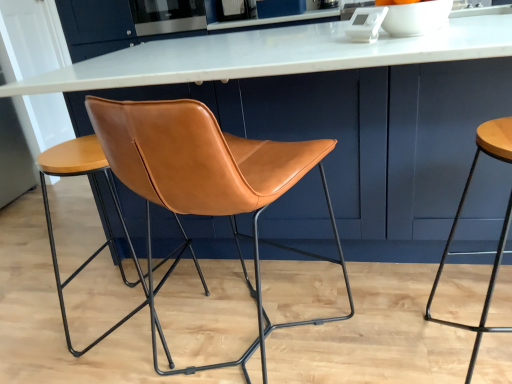
Find the location of a particular element. This screenshot has width=512, height=384. satin stainless steel oven at upper center is located at coordinates (167, 16).

This screenshot has width=512, height=384. Identify the location of matte brown stool at right, marked as the second stool in a left-to-right arrangement. (501, 231).

Looking at this image, measure the distance between leather at center, acting as the 2th stool starting from the right, and camera.

leather at center, acting as the 2th stool starting from the right, and camera are 1.21 meters apart from each other.

This screenshot has width=512, height=384. Describe the element at coordinates (206, 182) in the screenshot. I see `saddle brown leather chair at center` at that location.

Image resolution: width=512 pixels, height=384 pixels. In order to click on white marble table at center in this screenshot , I will do `click(271, 55)`.

Between saddle brown leather chair at center and satin stainless steel oven at upper center, which one is positioned in front?

saddle brown leather chair at center is closer to the camera.

From a real-world perspective, is saddle brown leather chair at center physically below satin stainless steel oven at upper center?

Indeed, from a real-world perspective, saddle brown leather chair at center is positioned beneath satin stainless steel oven at upper center.

From the image's perspective, which object appears higher, saddle brown leather chair at center or satin stainless steel oven at upper center?

satin stainless steel oven at upper center.

Considering the positions of objects saddle brown leather chair at center and satin stainless steel oven at upper center in the image provided, who is more to the right, saddle brown leather chair at center or satin stainless steel oven at upper center?

saddle brown leather chair at center is more to the right.

Is satin stainless steel oven at upper center in contact with leather at center, the 1th stool from the left?

No, satin stainless steel oven at upper center is not beside leather at center, the 1th stool from the left.

In terms of height, does satin stainless steel oven at upper center look taller or shorter compared to leather at center, acting as the 2th stool starting from the right?

Clearly, satin stainless steel oven at upper center is shorter compared to leather at center, acting as the 2th stool starting from the right.

Does satin stainless steel oven at upper center turn towards leather at center, the 1th stool from the left?

Yes, satin stainless steel oven at upper center is facing leather at center, the 1th stool from the left.

From a real-world perspective, which object rests below the other?

From a 3D spatial view, saddle brown leather chair at center is below.

Locate an element on the screen. This screenshot has height=384, width=512. chair beneath the satin stainless steel oven at upper center (from a real-world perspective) is located at coordinates (206, 182).

Is satin stainless steel oven at upper center far from saddle brown leather chair at center?

Yes.

Between leather at center, the 1th stool from the left, and saddle brown leather chair at center, which one has larger size?

saddle brown leather chair at center is bigger.

Between leather at center, the 1th stool from the left, and saddle brown leather chair at center, which one has smaller width?

With smaller width is leather at center, the 1th stool from the left.

Who is taller, leather at center, acting as the 2th stool starting from the right, or saddle brown leather chair at center?

saddle brown leather chair at center.

Considering the positions of point (84, 352) and point (208, 166), is point (84, 352) closer or farther from the camera than point (208, 166)?

Point (84, 352) is farther from the camera than point (208, 166).

Would you say leather at center, acting as the 2th stool starting from the right, is to the left or to the right of matte brown stool at right, marked as the second stool in a left-to-right arrangement, in the picture?

leather at center, acting as the 2th stool starting from the right, is to the left of matte brown stool at right, marked as the second stool in a left-to-right arrangement.

Consider the image. Measure the distance from leather at center, acting as the 2th stool starting from the right, to matte brown stool at right, marked as the second stool in a left-to-right arrangement.

leather at center, acting as the 2th stool starting from the right, is 1.22 meters away from matte brown stool at right, marked as the second stool in a left-to-right arrangement.

Where is `stool below the matte brown stool at right, marked as the second stool in a left-to-right arrangement (from a real-world perspective)`? The image size is (512, 384). stool below the matte brown stool at right, marked as the second stool in a left-to-right arrangement (from a real-world perspective) is located at coordinates (99, 208).

Is white marble table at center outside of leather at center, acting as the 2th stool starting from the right?

Indeed, white marble table at center is completely outside leather at center, acting as the 2th stool starting from the right.

Are white marble table at center and leather at center, the 1th stool from the left, far apart?

No, white marble table at center is not far from leather at center, the 1th stool from the left.

Which of these two, white marble table at center or leather at center, acting as the 2th stool starting from the right, stands taller?

Standing taller between the two is white marble table at center.

Considering the positions of objects white marble table at center and leather at center, acting as the 2th stool starting from the right, in the image provided, who is more to the left, white marble table at center or leather at center, acting as the 2th stool starting from the right,?

leather at center, acting as the 2th stool starting from the right.

Is saddle brown leather chair at center inside or outside of leather at center, the 1th stool from the left?

saddle brown leather chair at center is not enclosed by leather at center, the 1th stool from the left.

From a real-world perspective, between saddle brown leather chair at center and leather at center, acting as the 2th stool starting from the right, who is vertically higher?

saddle brown leather chair at center, from a real-world perspective.

Could you measure the distance between saddle brown leather chair at center and leather at center, acting as the 2th stool starting from the right?

saddle brown leather chair at center is 55.83 centimeters from leather at center, acting as the 2th stool starting from the right.

You are a GUI agent. You are given a task and a screenshot of the screen. Output one action in this format:
    pyautogui.click(x=<x>, y=<y>)
    Task: Click on the appliance that is above the saddle brown leather chair at center (from the image's perspective)
    
    Given the screenshot: What is the action you would take?
    coord(167,16)

You are a GUI agent. You are given a task and a screenshot of the screen. Output one action in this format:
    pyautogui.click(x=<x>, y=<y>)
    Task: Click on the 2nd stool positioned below the satin stainless steel oven at upper center (from the image's perspective)
    The height and width of the screenshot is (384, 512).
    Given the screenshot: What is the action you would take?
    click(x=99, y=208)

Based on their spatial positions, is saddle brown leather chair at center or matte brown stool at right, which is the 1th stool from right to left, further from leather at center, acting as the 2th stool starting from the right?

Based on the image, matte brown stool at right, which is the 1th stool from right to left, appears to be further to leather at center, acting as the 2th stool starting from the right.

Estimate the real-world distances between objects in this image. Which object is closer to matte brown stool at right, marked as the second stool in a left-to-right arrangement, leather at center, acting as the 2th stool starting from the right, or saddle brown leather chair at center?

Based on the image, saddle brown leather chair at center appears to be nearer to matte brown stool at right, marked as the second stool in a left-to-right arrangement.

Based on their spatial positions, is white marble table at center or satin stainless steel oven at upper center further from leather at center, acting as the 2th stool starting from the right?

satin stainless steel oven at upper center is further to leather at center, acting as the 2th stool starting from the right.

Estimate the real-world distances between objects in this image. Which object is further from leather at center, acting as the 2th stool starting from the right, saddle brown leather chair at center or white marble table at center?

white marble table at center lies further to leather at center, acting as the 2th stool starting from the right, than the other object.

Looking at the image, which one is located closer to white marble table at center, leather at center, acting as the 2th stool starting from the right, or saddle brown leather chair at center?

The object closer to white marble table at center is saddle brown leather chair at center.

When comparing their distances from matte brown stool at right, marked as the second stool in a left-to-right arrangement, does white marble table at center or leather at center, acting as the 2th stool starting from the right, seem further?

leather at center, acting as the 2th stool starting from the right, is positioned further to the anchor matte brown stool at right, marked as the second stool in a left-to-right arrangement.

Looking at the image, which one is located further to saddle brown leather chair at center, matte brown stool at right, marked as the second stool in a left-to-right arrangement, or leather at center, acting as the 2th stool starting from the right?

matte brown stool at right, marked as the second stool in a left-to-right arrangement, is further to saddle brown leather chair at center.

Considering their positions, is white marble table at center positioned closer to saddle brown leather chair at center than satin stainless steel oven at upper center?

white marble table at center.

Where is `table situated between saddle brown leather chair at center and matte brown stool at right, which is the 1th stool from right to left, from left to right`? This screenshot has width=512, height=384. table situated between saddle brown leather chair at center and matte brown stool at right, which is the 1th stool from right to left, from left to right is located at coordinates (271, 55).

In order to click on table positioned between matte brown stool at right, which is the 1th stool from right to left, and satin stainless steel oven at upper center from near to far in this screenshot , I will do `click(271, 55)`.

The height and width of the screenshot is (384, 512). Find the location of `table between leather at center, acting as the 2th stool starting from the right, and matte brown stool at right, marked as the second stool in a left-to-right arrangement`. table between leather at center, acting as the 2th stool starting from the right, and matte brown stool at right, marked as the second stool in a left-to-right arrangement is located at coordinates (271, 55).

Locate an element on the screen. This screenshot has width=512, height=384. chair situated between leather at center, the 1th stool from the left, and white marble table at center from left to right is located at coordinates (206, 182).